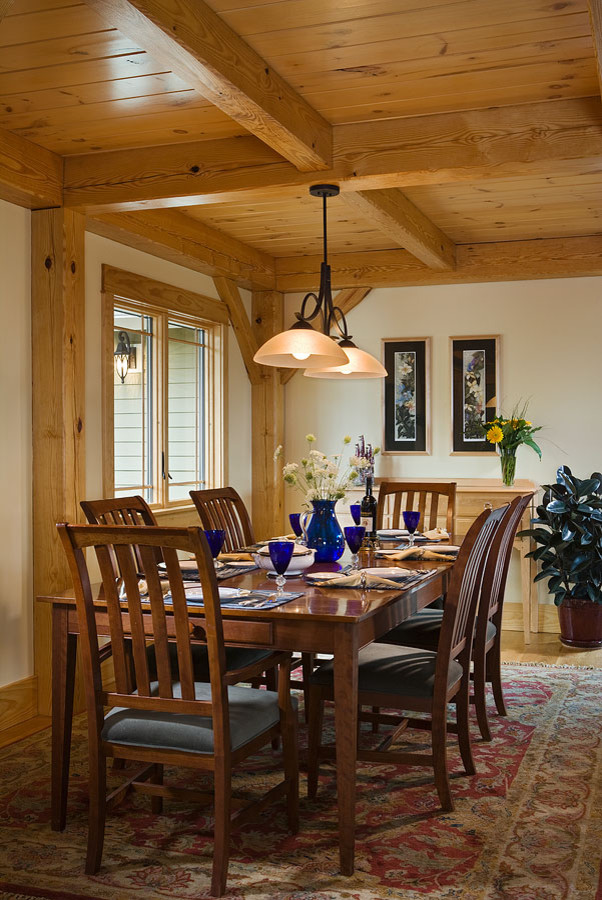
The image size is (602, 900). Identify the location of lamp. (298, 348), (350, 365), (122, 353).